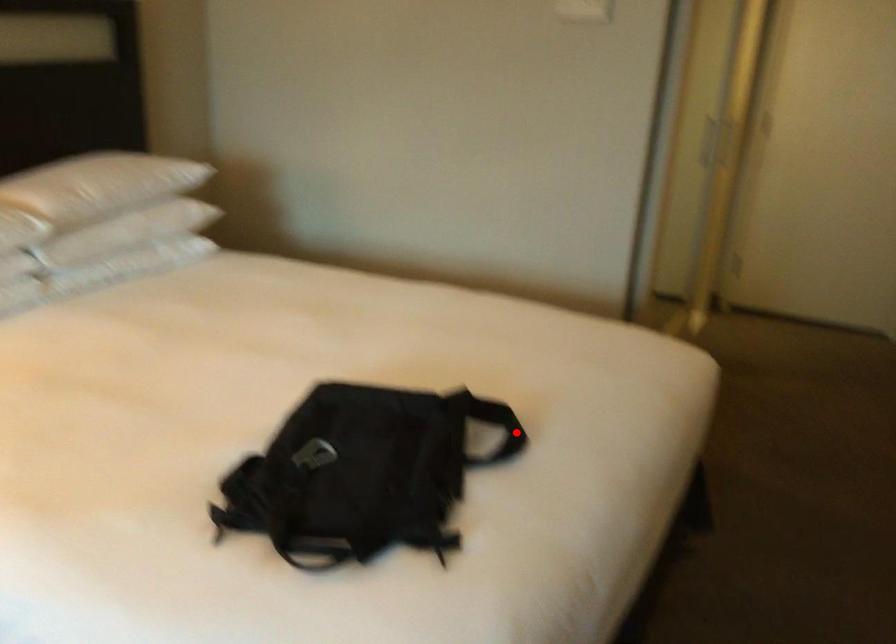
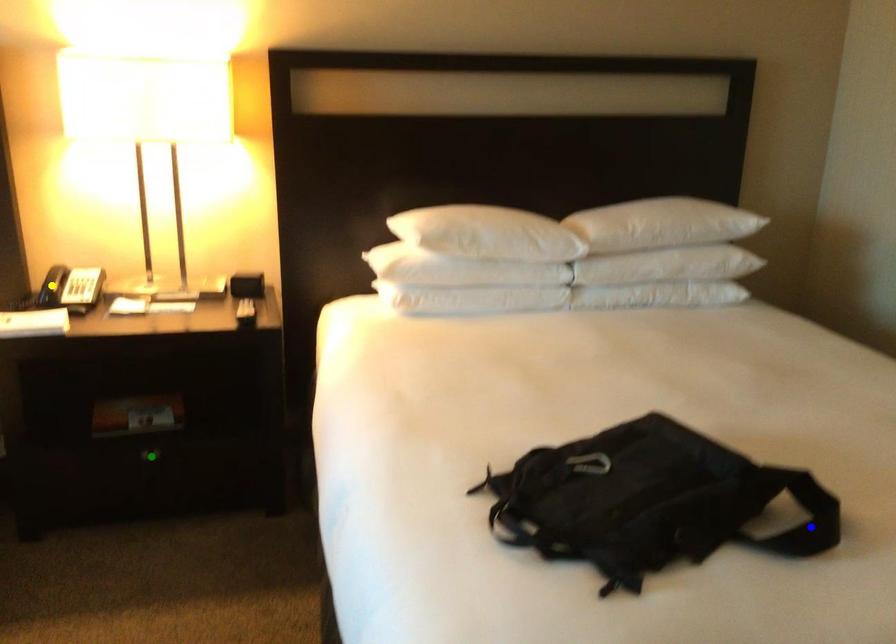
Question: I am providing you with two images of the same scene from different viewpoints. A red point is marked on the first image. You are given multiple points on the second image. Which point in image 2 is actually the same real-world point as the red point in image 1?

Choices:
 (A) blue point
 (B) yellow point
 (C) green point

Answer: (A)